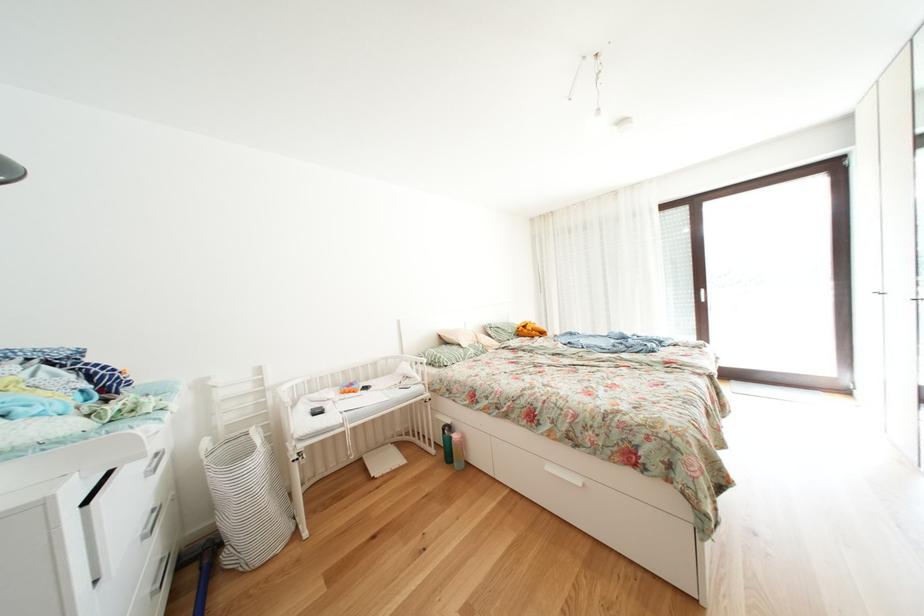
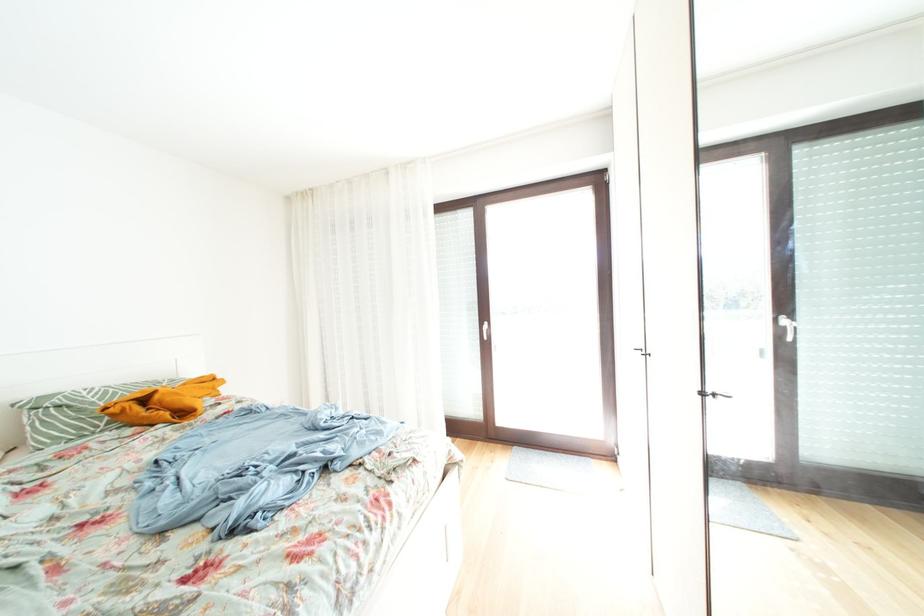
In a continuous first-person perspective shot, in which direction is the camera moving?

The cameraman walked toward right, forward.